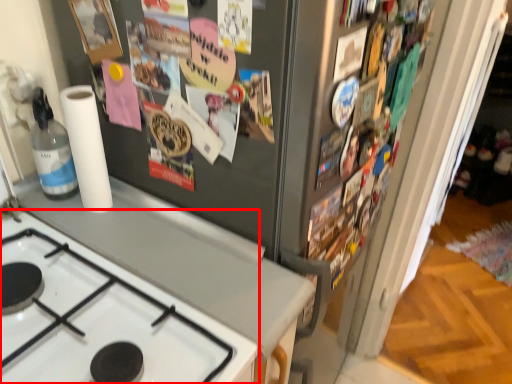
Question: Considering the relative positions of gas stove (annotated by the red box) and paper towel in the image provided, where is gas stove (annotated by the red box) located with respect to the staircase?

Choices:
 (A) right
 (B) left

Answer: (A)